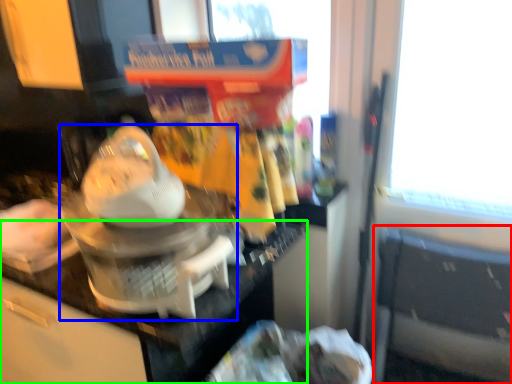
Question: Based on their relative distances, which object is farther from chair (highlighted by a red box)? Choose from kitchen appliance (highlighted by a blue box) and counter top (highlighted by a green box).

Choices:
 (A) kitchen appliance
 (B) counter top

Answer: (A)